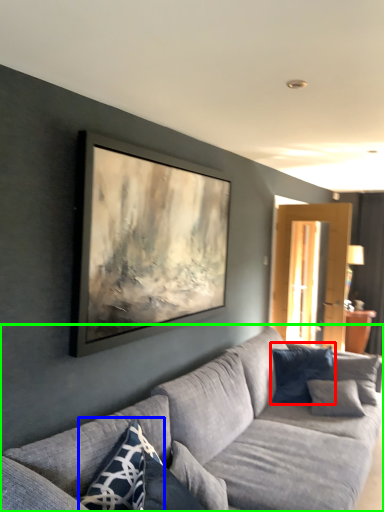
Question: Estimate the real-world distances between objects in this image. Which object is closer to pillow (highlighted by a red box), pillow (highlighted by a blue box) or studio couch (highlighted by a green box)?

Choices:
 (A) pillow
 (B) studio couch

Answer: (B)